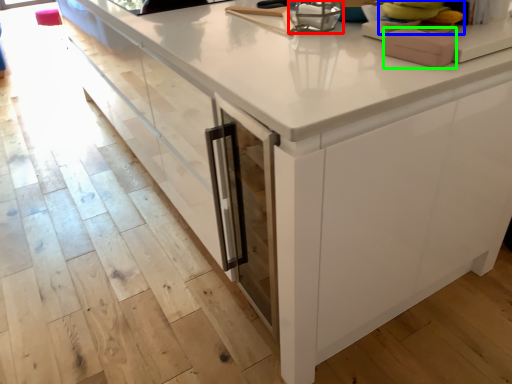
Question: Based on their relative distances, which object is farther from appliance (highlighted by a red box)? Choose from food (highlighted by a blue box) and appliance (highlighted by a green box).

Choices:
 (A) food
 (B) appliance

Answer: (B)